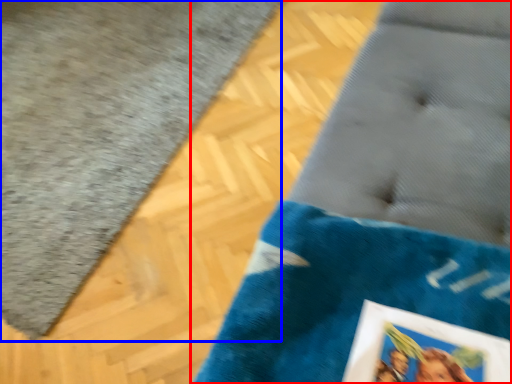
Question: Which object appears farthest to the camera in this image, furniture (highlighted by a red box) or bath mat (highlighted by a blue box)?

Choices:
 (A) furniture
 (B) bath mat

Answer: (B)